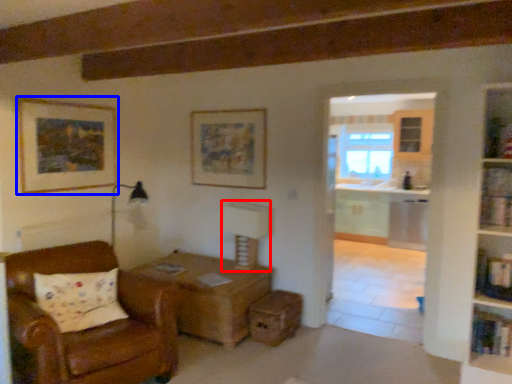
Question: Which point is further to the camera, table lamp (highlighted by a red box) or picture frame (highlighted by a blue box)?

Choices:
 (A) table lamp
 (B) picture frame

Answer: (A)